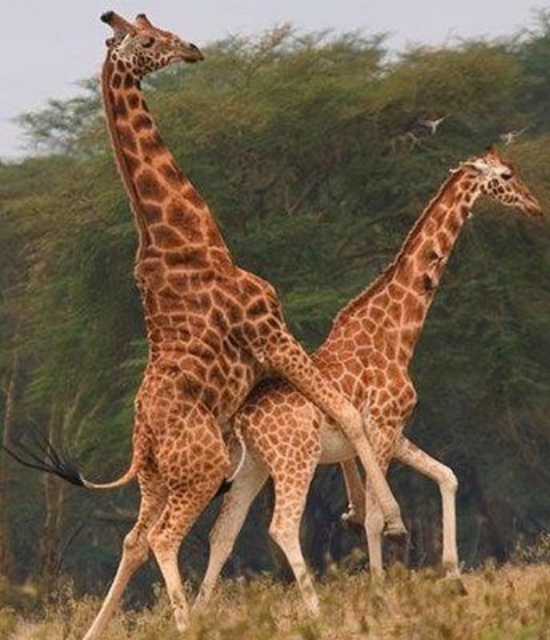
Question: In this image, where is spotted fur giraffe at center located relative to green grass at lower center?

Choices:
 (A) below
 (B) above

Answer: (B)

Question: Can you confirm if spotted fur giraffe at center is bigger than brown spotted giraffe at center?

Choices:
 (A) no
 (B) yes

Answer: (A)

Question: Which of the following is the farthest from the observer?

Choices:
 (A) spotted fur giraffe at center
 (B) brown spotted giraffe at center
 (C) green grass at lower center

Answer: (B)

Question: Among these objects, which one is nearest to the camera?

Choices:
 (A) green grass at lower center
 (B) spotted fur giraffe at center
 (C) brown spotted giraffe at center

Answer: (A)

Question: Can you confirm if brown spotted giraffe at center is positioned to the right of green grass at lower center?

Choices:
 (A) no
 (B) yes

Answer: (A)

Question: Which object is the closest to the green grass at lower center?

Choices:
 (A) spotted fur giraffe at center
 (B) brown spotted giraffe at center

Answer: (B)